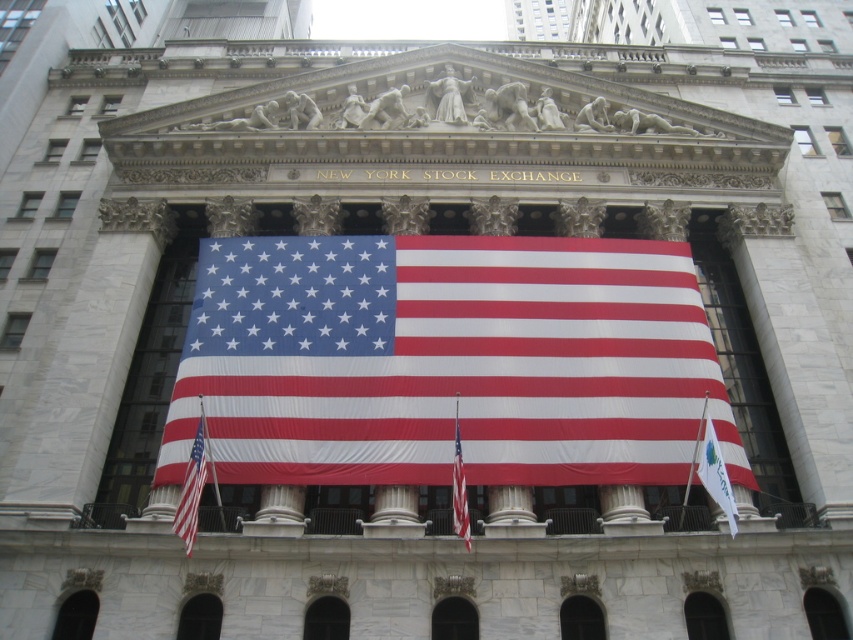
Where is `red-white striped fabric flag at center`? The width and height of the screenshot is (853, 640). red-white striped fabric flag at center is located at coordinates (193, 486).

Which is in front, point (198, 499) or point (706, 484)?

Point (198, 499)

Does point (194, 493) come behind point (708, 426)?

No, it is not.

Find the location of `red-white striped fabric flag at center`. red-white striped fabric flag at center is located at coordinates (193, 486).

Who is shorter, polyester american flag at center or red fabric flag at center?

Standing shorter between the two is red fabric flag at center.

Does polyester american flag at center have a smaller size compared to red fabric flag at center?

Actually, polyester american flag at center might be larger than red fabric flag at center.

At what (x,y) coordinates should I click in order to perform the action: click on polyester american flag at center. Please return your answer as a coordinate pair (x, y). Looking at the image, I should click on (447, 362).

Between red-white striped fabric flag at center and red fabric flag at center, which one is positioned lower?

red fabric flag at center is below.

Between point (195, 461) and point (457, 515), which one is positioned in front?

Point (457, 515) is in front.

Image resolution: width=853 pixels, height=640 pixels. What do you see at coordinates (193, 486) in the screenshot?
I see `red-white striped fabric flag at center` at bounding box center [193, 486].

Find the location of a particular element. Image resolution: width=853 pixels, height=640 pixels. red-white striped fabric flag at center is located at coordinates (193, 486).